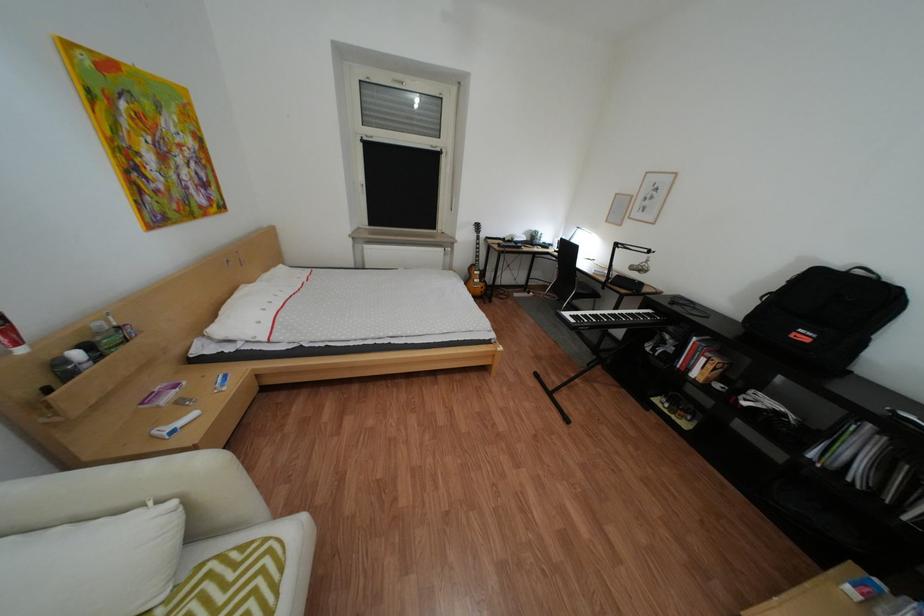
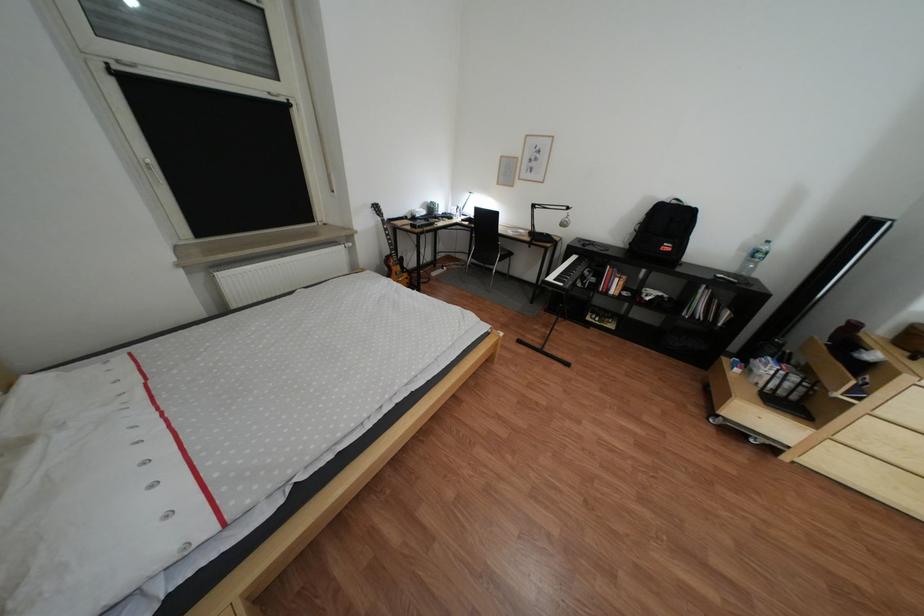
In the second image, find the point that corresponds to point 820,337 in the first image.

(683, 248)